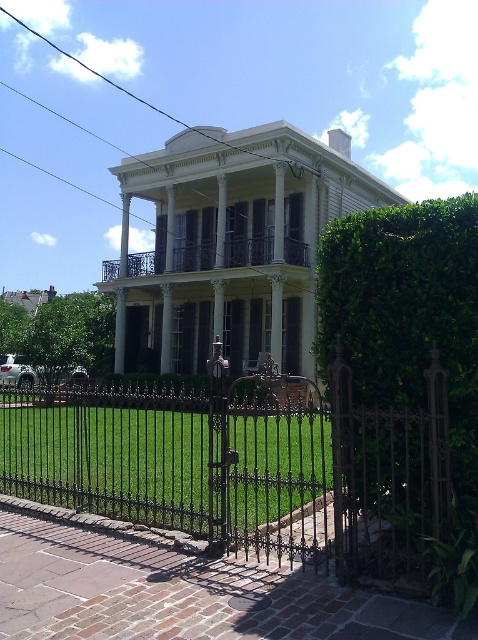
You are standing in front of the house and want to walk from the green leafy hedge at right to the white wrought iron porch at center. Which direction should you move towards?

The green leafy hedge at right is positioned on the right side of the white wrought iron porch at center, so you should move towards the left to reach the white wrought iron porch at center from the green leafy hedge at right.

You are standing in front of the house and want to walk to the white wrought iron porch at center. Is the green leafy hedge at right blocking your path?

The green leafy hedge at right is in front of the white wrought iron porch at center, so it is blocking the path to the porch.

You are a delivery person approaching the house and need to determine the best path to the front door. The black wrought iron gate at center and the green leafy hedge at right are both in your path. Which object should you navigate around to reach the front door?

The black wrought iron gate at center is likely the entrance, so you should navigate through it rather than around the green leafy hedge at right.